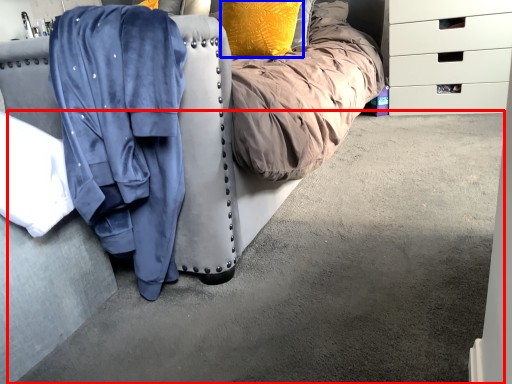
Question: Which of the following is the closest to the observer, concrete (highlighted by a red box) or pillow (highlighted by a blue box)?

Choices:
 (A) concrete
 (B) pillow

Answer: (A)